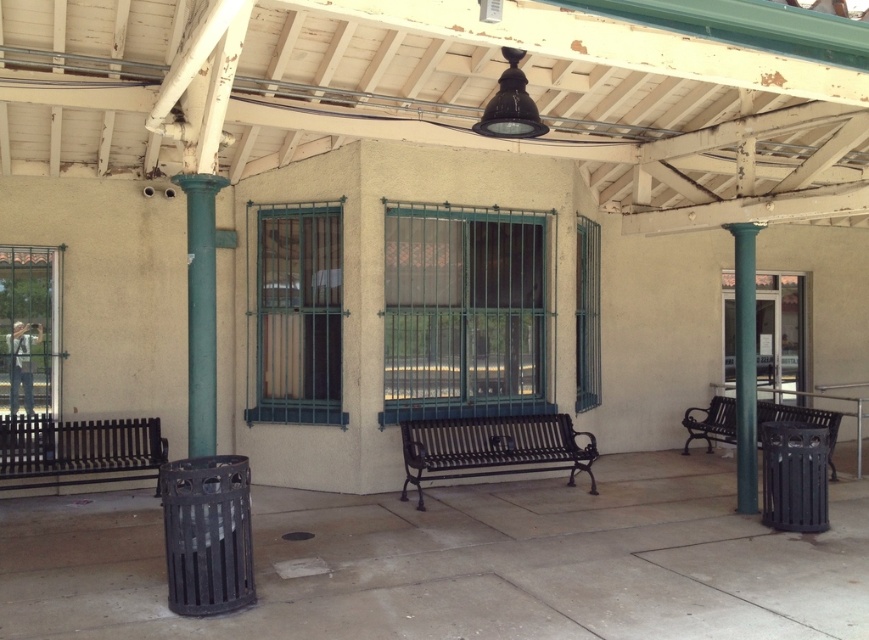
Does black wrought iron bench at center have a greater width compared to black metal bench at right?

Indeed, black wrought iron bench at center has a greater width compared to black metal bench at right.

The width and height of the screenshot is (869, 640). Find the location of `black wrought iron bench at center`. black wrought iron bench at center is located at coordinates (492, 448).

Is point (554, 422) behind point (778, 406)?

No, (554, 422) is closer to viewer.

The height and width of the screenshot is (640, 869). Identify the location of black wrought iron bench at center. (492, 448).

Is black metal bench at left thinner than green painted metal column at right?

No, black metal bench at left is not thinner than green painted metal column at right.

Is black metal bench at left wider than green painted metal column at right?

Yes.

Locate an element on the screen. black metal bench at left is located at coordinates (78, 449).

Find the location of a particular element. This screenshot has width=869, height=640. black metal bench at left is located at coordinates (78, 449).

Does black wrought iron bench at center have a lesser height compared to black metal bench at left?

Correct, black wrought iron bench at center is not as tall as black metal bench at left.

Is black wrought iron bench at center wider than black metal bench at left?

Yes, black wrought iron bench at center is wider than black metal bench at left.

Locate an element on the screen. The height and width of the screenshot is (640, 869). black wrought iron bench at center is located at coordinates (492, 448).

Locate an element on the screen. Image resolution: width=869 pixels, height=640 pixels. black wrought iron bench at center is located at coordinates (492, 448).